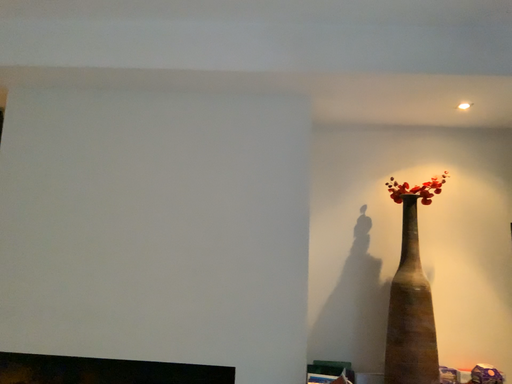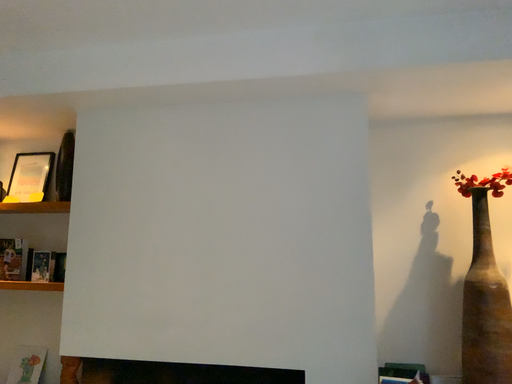
Question: How did the camera likely rotate when shooting the video?

Choices:
 (A) rotated left
 (B) rotated right

Answer: (A)